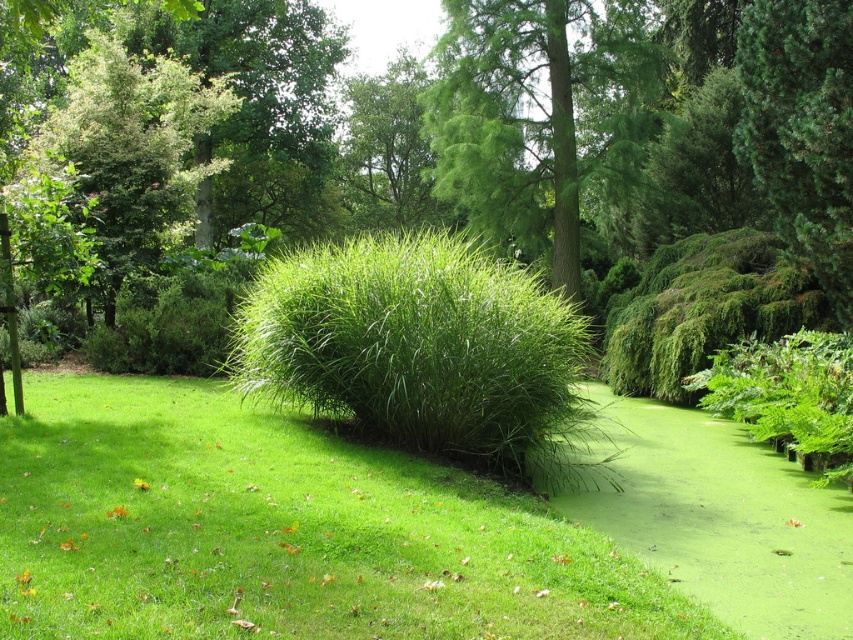
Question: Can you confirm if green leafy bush at center is positioned to the right of green needle-like at upper right?

Choices:
 (A) no
 (B) yes

Answer: (A)

Question: Which point is farther from the camera taking this photo?

Choices:
 (A) (468, 387)
 (B) (808, 45)

Answer: (B)

Question: Is green leafy bush at center below green leafy tree at upper left?

Choices:
 (A) yes
 (B) no

Answer: (A)

Question: Does green leafy grass at center lie in front of green leafy tree at center?

Choices:
 (A) no
 (B) yes

Answer: (B)

Question: Among these points, which one is nearest to the camera?

Choices:
 (A) (273, 284)
 (B) (833, 246)
 (C) (132, 182)

Answer: (A)

Question: Which point is farther to the camera?

Choices:
 (A) (407, 288)
 (B) (161, 104)

Answer: (B)